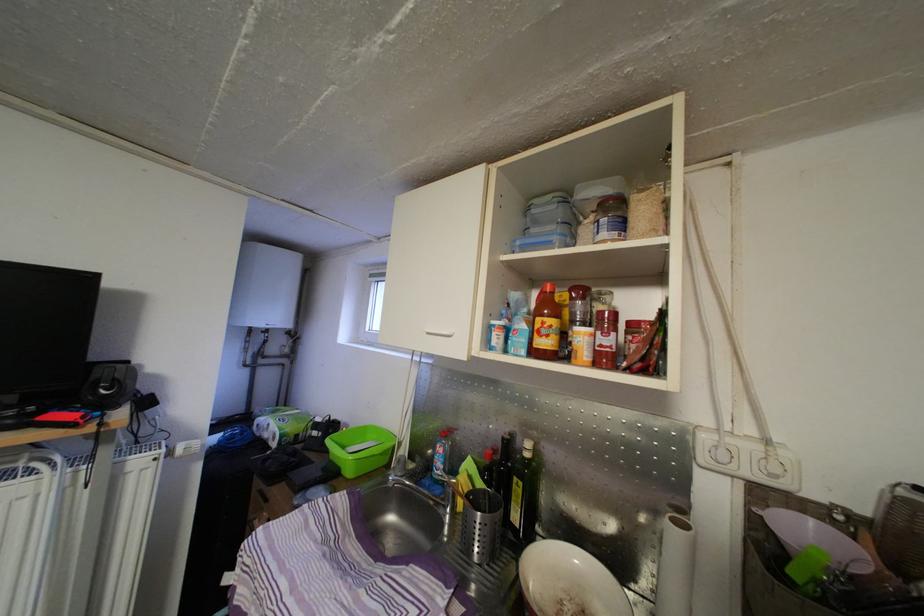
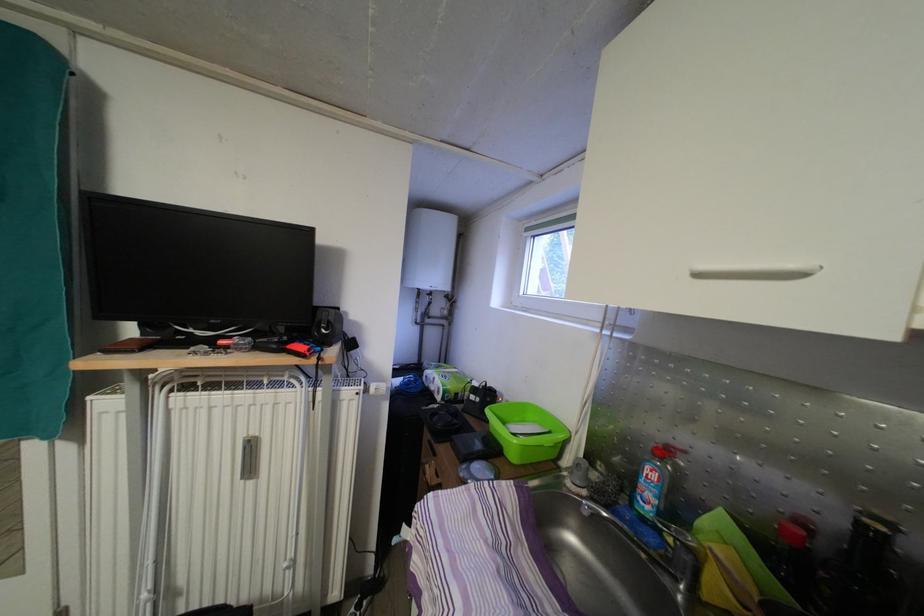
Where in the second image is the point corresponding to point (447, 456) from the first image?

(661, 484)